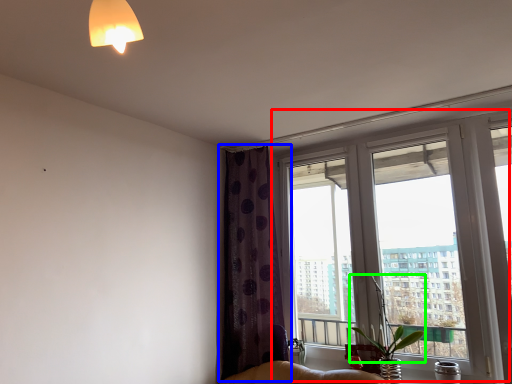
Question: Which is farther away from window (highlighted by a red box)? curtain (highlighted by a blue box) or plant (highlighted by a green box)?

Choices:
 (A) curtain
 (B) plant

Answer: (B)